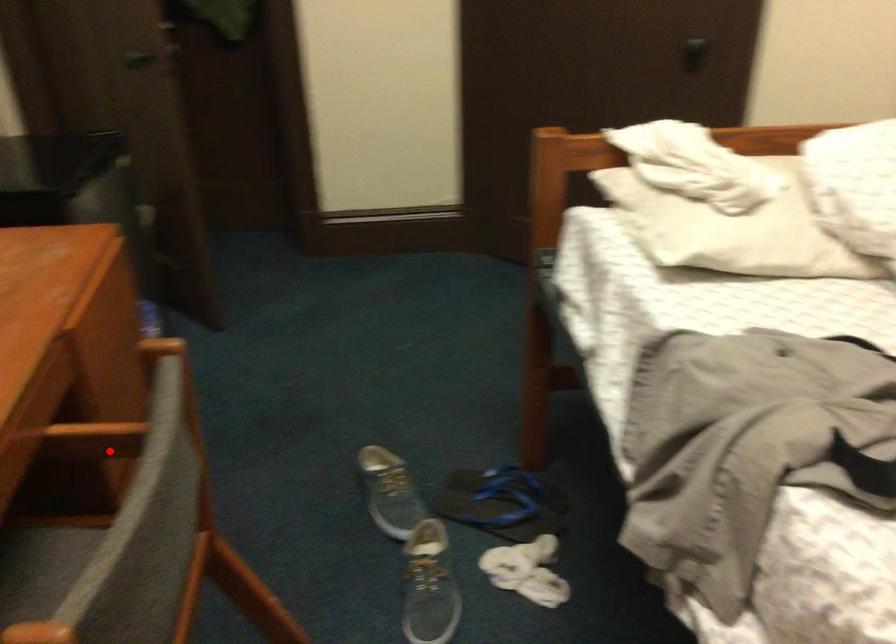
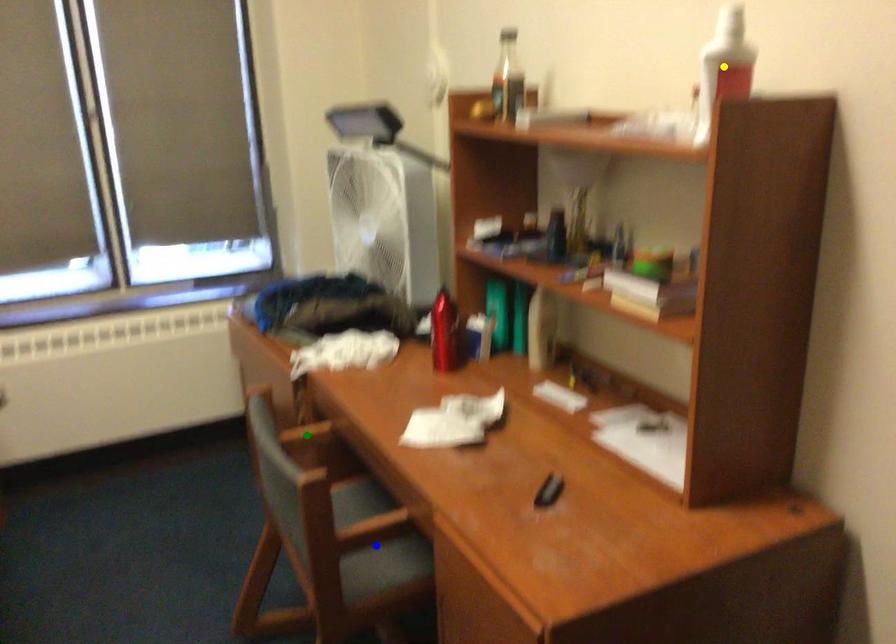
Question: I am providing you with two images of the same scene from different viewpoints. A red point is marked on the first image. You are given multiple points on the second image. Which spot in image 2 lines up with the point in image 1?

Choices:
 (A) blue point
 (B) yellow point
 (C) green point

Answer: (A)